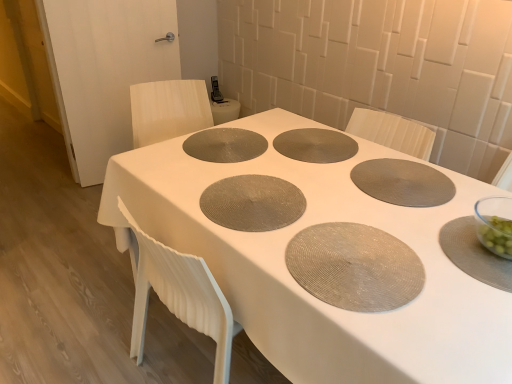
Where is `blank space to the left of matte gray placemat at center, the 2th pizza pan when ordered from left to right`? The image size is (512, 384). blank space to the left of matte gray placemat at center, the 2th pizza pan when ordered from left to right is located at coordinates (237, 146).